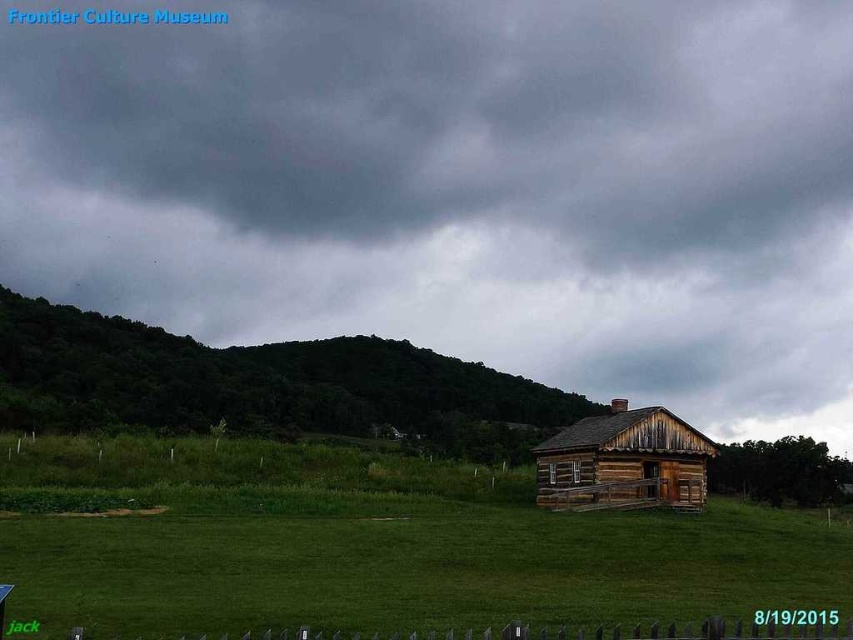
Is green grassy at lower center above green leafy hillside at upper left?

No.

Which is in front, point (397, 580) or point (517, 412)?

Positioned in front is point (397, 580).

This screenshot has height=640, width=853. I want to click on green grassy at lower center, so click(x=373, y=544).

Is dark gray cloud at upper center taller than weathered wood log cabin at center?

Yes.

Who is higher up, dark gray cloud at upper center or weathered wood log cabin at center?

dark gray cloud at upper center is higher up.

Is point (263, 230) positioned in front of point (659, 493)?

No, it is not.

Find the location of a particular element. The height and width of the screenshot is (640, 853). dark gray cloud at upper center is located at coordinates (460, 186).

Is dark gray cloud at upper center shorter than green leafy hillside at upper left?

No.

In the scene shown: Is the position of dark gray cloud at upper center less distant than that of green leafy hillside at upper left?

No, dark gray cloud at upper center is behind green leafy hillside at upper left.

Is point (196, 337) positioned before point (107, 406)?

No, (196, 337) is further to viewer.

Locate an element on the screen. The height and width of the screenshot is (640, 853). dark gray cloud at upper center is located at coordinates (460, 186).